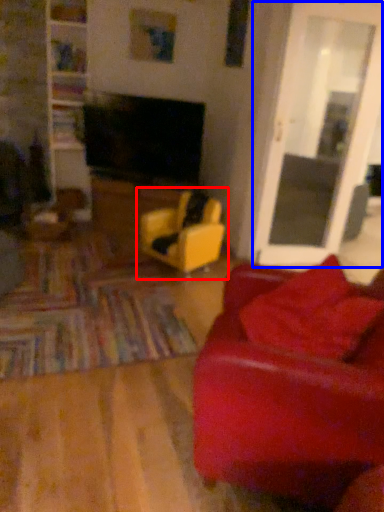
Question: Which object appears farthest to the camera in this image, chair (highlighted by a red box) or glass door (highlighted by a blue box)?

Choices:
 (A) chair
 (B) glass door

Answer: (A)